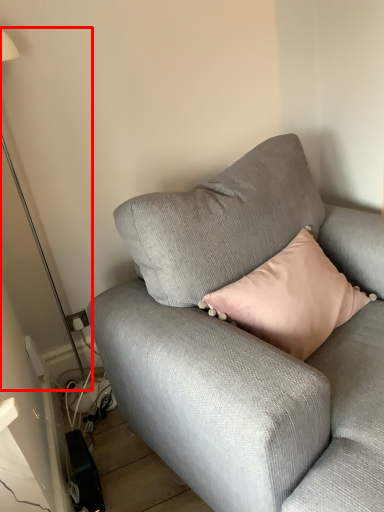
Question: From the image, what is the correct spatial relationship of table lamp (annotated by the red box) in relation to studio couch?

Choices:
 (A) right
 (B) left

Answer: (B)